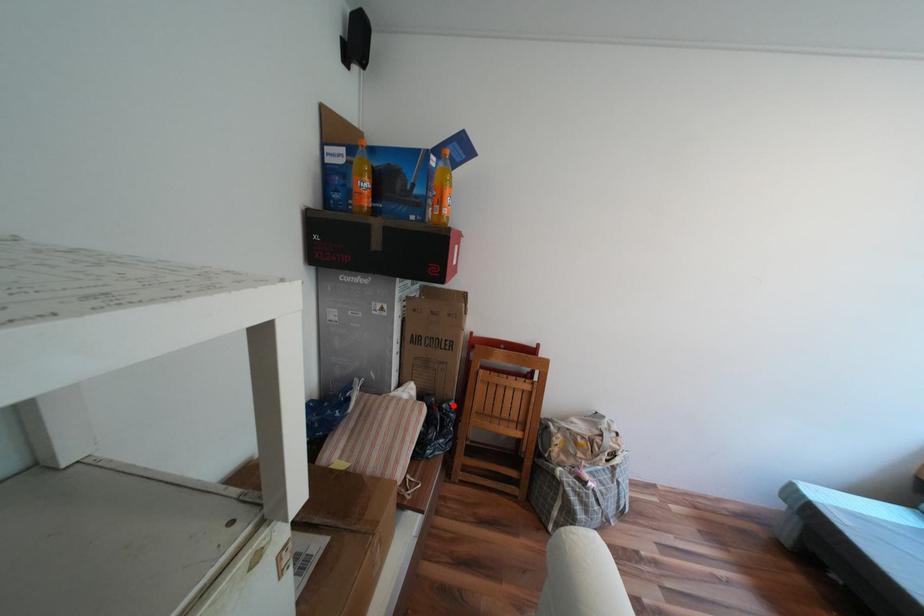
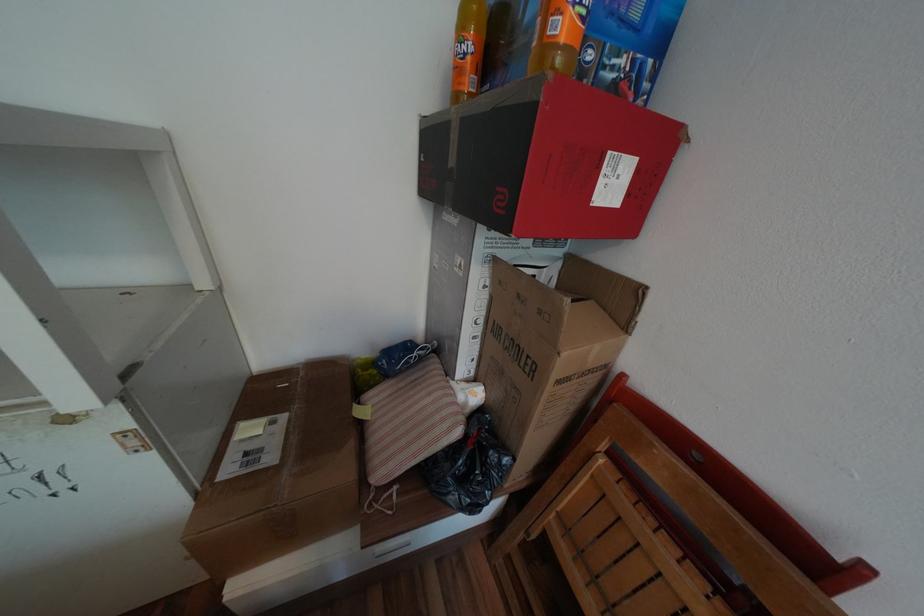
Find the pixel in the second image that matches the highlighted location in the first image.

(500, 453)